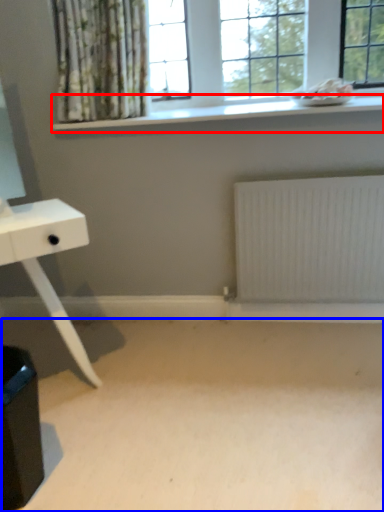
Question: Which object appears closest to the camera in this image, window sill (highlighted by a red box) or plain (highlighted by a blue box)?

Choices:
 (A) window sill
 (B) plain

Answer: (B)